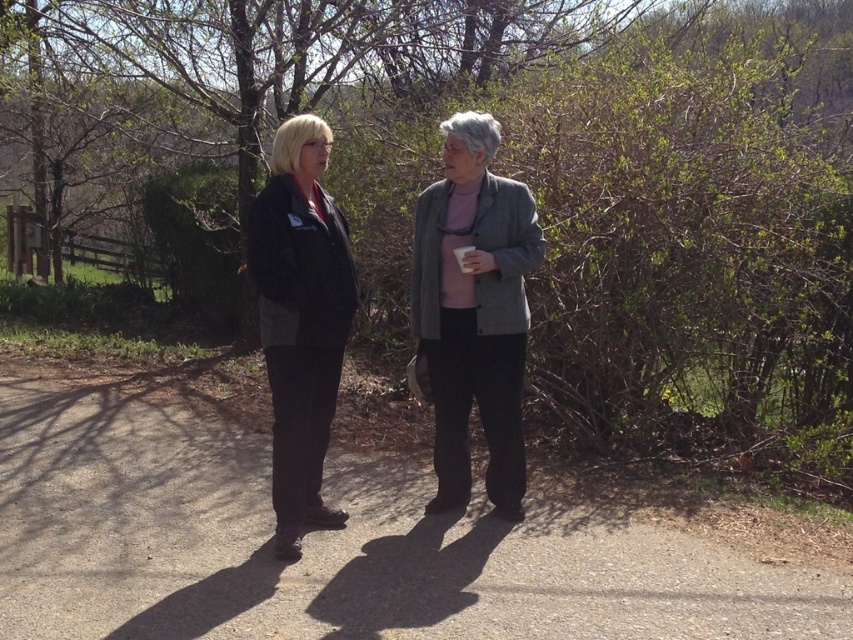
You are standing at the point labeled as point (338, 545). What surface are you standing on?

The point (338, 545) is on the gray asphalt path at center, so you are standing on the gray asphalt path.

You are a delivery drone that needs to land on the gray asphalt path at center. However, there is a gray woolen blazer at center in the way. Can you safely land on the path without hitting the blazer?

The gray asphalt path at center has a lesser height compared to the gray woolen blazer at center. Since the path is lower, the drone can safely land on it as long as it avoids the area occupied by the blazer.